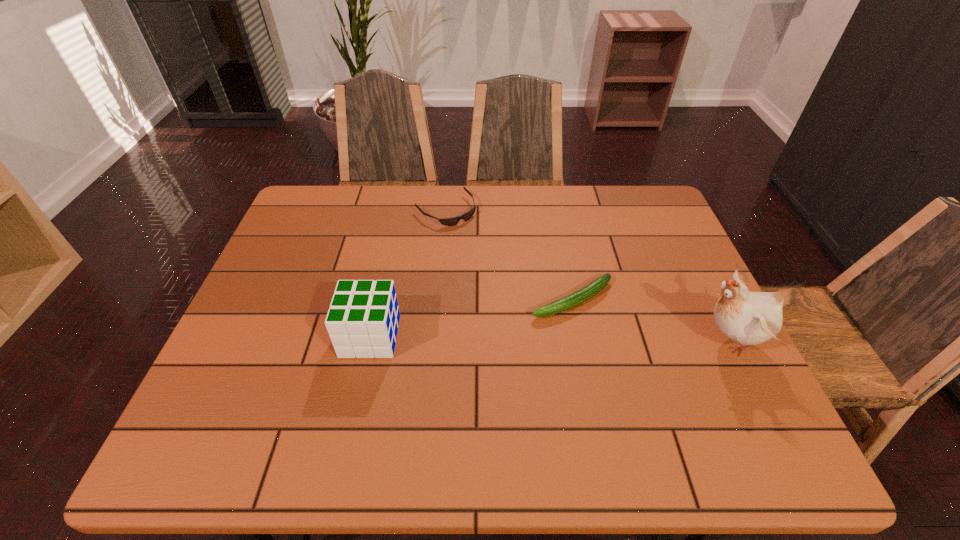
Find the location of a particular element. vacant space on the desktop that is between the second tallest object and the tallest object and is positioned on the front-facing side of the zucchini is located at coordinates (495, 338).

Where is `vacant spot on the desktop that is between the cube and the tallest object and is positioned on the front-facing side of the shortest object`? This screenshot has height=540, width=960. vacant spot on the desktop that is between the cube and the tallest object and is positioned on the front-facing side of the shortest object is located at coordinates (570, 338).